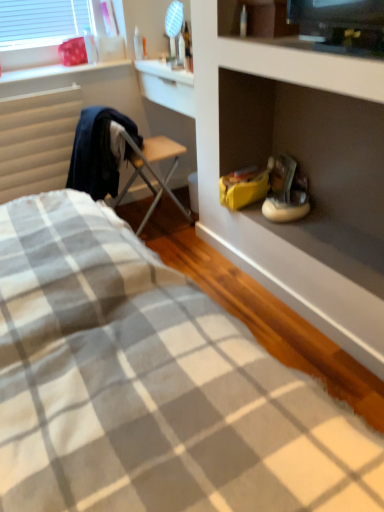
This screenshot has width=384, height=512. What are the coordinates of `matte white cabinet at upper right` in the screenshot? It's located at (296, 60).

At what (x,y) coordinates should I click in order to perform the action: click on white painted wood at upper left. Please return your answer as a coordinate pair (x, y). Looking at the image, I should click on click(61, 72).

Image resolution: width=384 pixels, height=512 pixels. What do you see at coordinates (286, 192) in the screenshot?
I see `white matte sneakers at center-right` at bounding box center [286, 192].

What is the approximate width of beige fabric radiator at left?

The width of beige fabric radiator at left is 7.90 centimeters.

Find the location of a particular element. Image resolution: width=384 pixels, height=512 pixels. gray checkered fabric at lower left is located at coordinates (151, 385).

This screenshot has width=384, height=512. I want to click on matte white cabinet at upper right, so click(x=296, y=60).

Considering the relative sizes of beige fabric radiator at left and white painted wood at upper left in the image provided, is beige fabric radiator at left smaller than white painted wood at upper left?

No, beige fabric radiator at left is not smaller than white painted wood at upper left.

Which object is closer to the camera taking this photo, beige fabric radiator at left or white painted wood at upper left?

beige fabric radiator at left is more forward.

Is beige fabric radiator at left to the right of white painted wood at upper left from the viewer's perspective?

No.

Is beige fabric radiator at left wider or thinner than white painted wood at upper left?

Clearly, beige fabric radiator at left has less width compared to white painted wood at upper left.

Considering the relative sizes of matte white cabinet at upper right and white matte sneakers at center-right in the image provided, is matte white cabinet at upper right bigger than white matte sneakers at center-right?

Yes, matte white cabinet at upper right is bigger than white matte sneakers at center-right.

Measure the distance between matte white cabinet at upper right and white matte sneakers at center-right.

23.50 inches.

Does matte white cabinet at upper right lie behind white matte sneakers at center-right?

No.

From the image's perspective, which is below, matte white cabinet at upper right or white matte sneakers at center-right?

white matte sneakers at center-right.

Between white matte sneakers at center-right and matte white cabinet at upper right, which one has less height?

matte white cabinet at upper right.

What's the angular difference between white matte sneakers at center-right and matte white cabinet at upper right's facing directions?

3.05 degrees.

From a real-world perspective, which is physically above, white matte sneakers at center-right or matte white cabinet at upper right?

matte white cabinet at upper right is physically above.

This screenshot has height=512, width=384. Find the location of `footwear located behind the matte white cabinet at upper right`. footwear located behind the matte white cabinet at upper right is located at coordinates (286, 192).

How many degrees apart are the facing directions of white matte sneakers at center-right and white painted wood at upper left?

The angular difference between white matte sneakers at center-right and white painted wood at upper left is 92.5 degrees.

Looking at this image, from the image's perspective, would you say white matte sneakers at center-right is shown under white painted wood at upper left?

Yes, from the image's perspective, white matte sneakers at center-right is beneath white painted wood at upper left.

From the picture: Is white matte sneakers at center-right far away from white painted wood at upper left?

white matte sneakers at center-right is far away from white painted wood at upper left.

Based on the photo, from a real-world perspective, who is located lower, white matte sneakers at center-right or beige fabric radiator at left?

From a 3D spatial view, white matte sneakers at center-right is below.

Is white matte sneakers at center-right smaller than beige fabric radiator at left?

Yes, white matte sneakers at center-right is smaller than beige fabric radiator at left.

Considering the sizes of objects white matte sneakers at center-right and beige fabric radiator at left in the image provided, who is wider, white matte sneakers at center-right or beige fabric radiator at left?

white matte sneakers at center-right.

How far apart are white matte sneakers at center-right and beige fabric radiator at left?

white matte sneakers at center-right and beige fabric radiator at left are 1.23 meters apart.

Is beige fabric radiator at left closer to the viewer compared to gray checkered fabric at lower left?

No, beige fabric radiator at left is further to the viewer.

Is point (5, 164) closer to camera compared to point (295, 395)?

No, it is not.

Does beige fabric radiator at left appear on the right side of gray checkered fabric at lower left?

In fact, beige fabric radiator at left is to the left of gray checkered fabric at lower left.

In the scene shown: Is white painted wood at upper left not near wooden folding chair at center?

They are positioned close to each other.

From a real-world perspective, which object rests below the other?

wooden folding chair at center is physically lower.

The height and width of the screenshot is (512, 384). In order to click on window sill that is above the wooden folding chair at center (from the image's perspective) in this screenshot , I will do `click(61, 72)`.

Does white painted wood at upper left have a greater height compared to wooden folding chair at center?

In fact, white painted wood at upper left may be shorter than wooden folding chair at center.

The width and height of the screenshot is (384, 512). In order to click on window sill above the beige fabric radiator at left (from the image's perspective) in this screenshot , I will do `click(61, 72)`.

You are a GUI agent. You are given a task and a screenshot of the screen. Output one action in this format:
    pyautogui.click(x=<x>, y=<y>)
    Task: Click on the footwear on the left of matte white cabinet at upper right
    This screenshot has width=384, height=512.
    Given the screenshot: What is the action you would take?
    pyautogui.click(x=286, y=192)

Considering their positions, is matte white cabinet at upper right positioned further to white painted wood at upper left than white matte sneakers at center-right?

white matte sneakers at center-right.

Estimate the real-world distances between objects in this image. Which object is further from wooden folding chair at center, gray checkered fabric at lower left or beige fabric radiator at left?

Based on the image, gray checkered fabric at lower left appears to be further to wooden folding chair at center.

Considering their positions, is matte white cabinet at upper right positioned further to white painted wood at upper left than wooden folding chair at center?

Based on the image, matte white cabinet at upper right appears to be further to white painted wood at upper left.

Based on their spatial positions, is beige fabric radiator at left or white matte sneakers at center-right further from white painted wood at upper left?

Based on the image, white matte sneakers at center-right appears to be further to white painted wood at upper left.

When comparing their distances from wooden folding chair at center, does gray checkered fabric at lower left or white matte sneakers at center-right seem further?

gray checkered fabric at lower left is further to wooden folding chair at center.

Estimate the real-world distances between objects in this image. Which object is further from matte white cabinet at upper right, beige fabric radiator at left or gray checkered fabric at lower left?

Among the two, beige fabric radiator at left is located further to matte white cabinet at upper right.

Estimate the real-world distances between objects in this image. Which object is closer to white matte sneakers at center-right, beige fabric radiator at left or matte white cabinet at upper right?

matte white cabinet at upper right is closer to white matte sneakers at center-right.

Looking at the image, which one is located further to gray checkered fabric at lower left, matte white cabinet at upper right or beige fabric radiator at left?

beige fabric radiator at left.

Locate an element on the screen. Image resolution: width=384 pixels, height=512 pixels. chair between white painted wood at upper left and white matte sneakers at center-right from left to right is located at coordinates (152, 170).

The height and width of the screenshot is (512, 384). I want to click on chair located between gray checkered fabric at lower left and beige fabric radiator at left in the depth direction, so click(x=152, y=170).

I want to click on window sill between beige fabric radiator at left and white matte sneakers at center-right from left to right, so click(61, 72).

You are a GUI agent. You are given a task and a screenshot of the screen. Output one action in this format:
    pyautogui.click(x=<x>, y=<y>)
    Task: Click on the footwear positioned between gray checkered fabric at lower left and white painted wood at upper left from near to far
    The height and width of the screenshot is (512, 384).
    Given the screenshot: What is the action you would take?
    pyautogui.click(x=286, y=192)